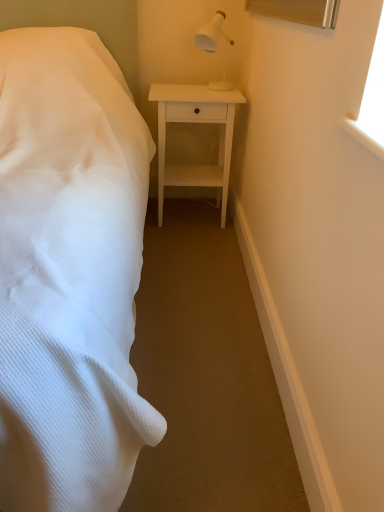
In order to click on vacant space underneath white plastic lamp at upper right (from a real-world perspective) in this screenshot , I will do `click(221, 87)`.